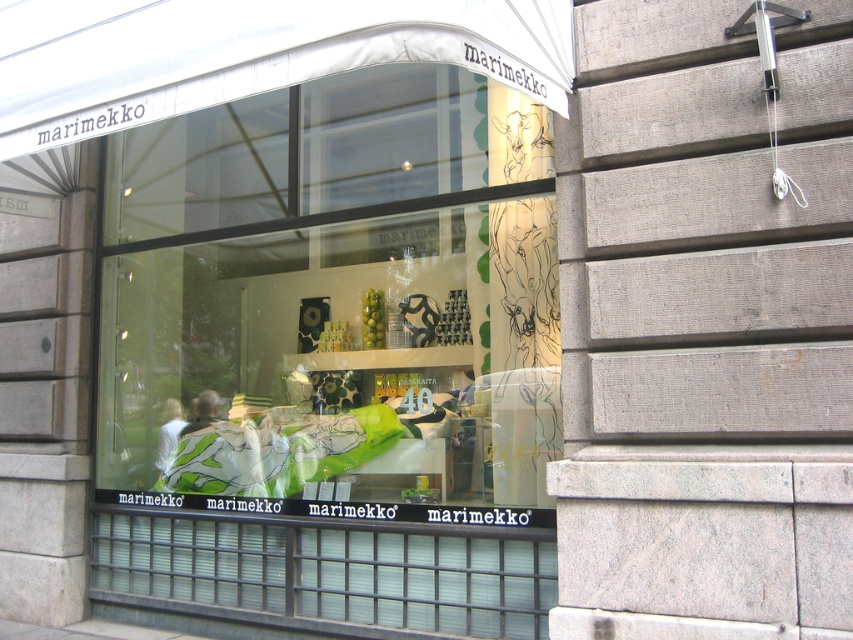
Is green fabric pillows at center positioned before matte green fabric at center?

Yes, green fabric pillows at center is in front of matte green fabric at center.

Does green fabric pillows at center lie behind matte green fabric at center?

No, green fabric pillows at center is in front of matte green fabric at center.

The height and width of the screenshot is (640, 853). What are the coordinates of `green fabric pillows at center` in the screenshot? It's located at [341, 304].

The image size is (853, 640). In order to click on green fabric pillows at center in this screenshot , I will do `click(341, 304)`.